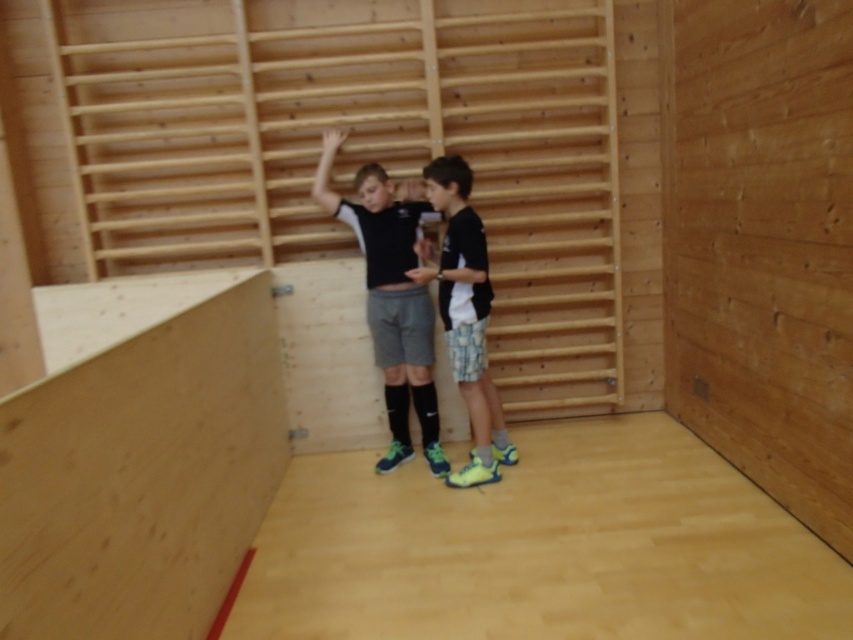
The height and width of the screenshot is (640, 853). Describe the element at coordinates (138, 456) in the screenshot. I see `light brown wood ramp at lower left` at that location.

Consider the image. Is light brown wood ramp at lower left further to the viewer compared to black matte shirt at center?

No, it is in front of black matte shirt at center.

Who is more distant from viewer, (74, 476) or (494, 451)?

The point (494, 451) is more distant.

Where is `light brown wood ramp at lower left`? light brown wood ramp at lower left is located at coordinates (138, 456).

Does black matte shorts at center lie behind black matte shirt at center?

Yes, black matte shorts at center is further from the viewer.

Can you confirm if black matte shorts at center is shorter than black matte shirt at center?

No.

Locate an element on the screen. This screenshot has height=640, width=853. black matte shorts at center is located at coordinates (390, 300).

This screenshot has width=853, height=640. I want to click on black matte shorts at center, so click(390, 300).

Can you confirm if light brown wood ramp at lower left is shorter than black matte shorts at center?

Yes, light brown wood ramp at lower left is shorter than black matte shorts at center.

Who is positioned more to the right, light brown wood ramp at lower left or black matte shorts at center?

black matte shorts at center is more to the right.

Between point (119, 413) and point (405, 300), which one is positioned in front?

Point (119, 413)

Locate an element on the screen. The image size is (853, 640). light brown wood ramp at lower left is located at coordinates (138, 456).